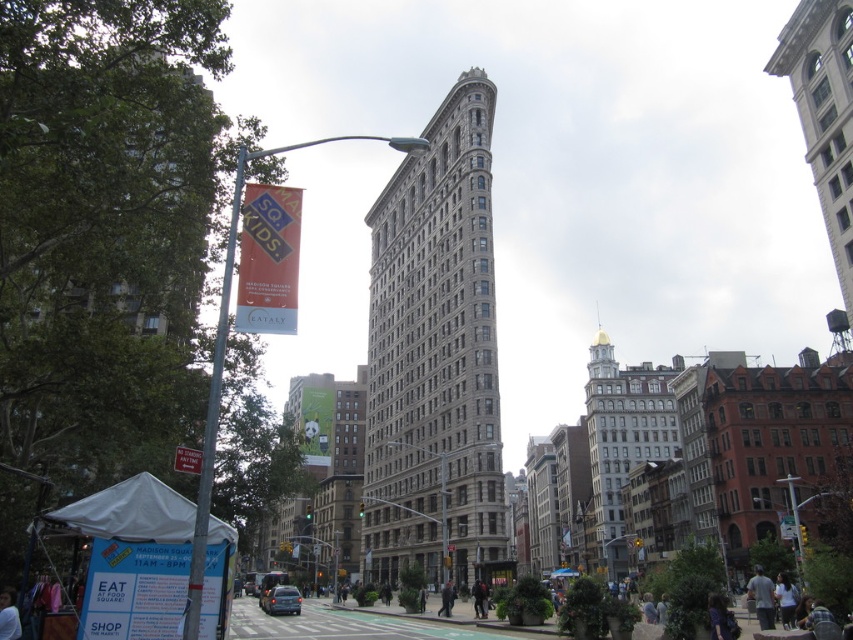
Question: Can you confirm if gray stone building at center is bigger than white stone bell tower at upper right?

Choices:
 (A) yes
 (B) no

Answer: (B)

Question: Is white stone bell tower at upper right above red plastic sign at lower left?

Choices:
 (A) yes
 (B) no

Answer: (A)

Question: Where is light gray shirt at lower right located in relation to white plastic street sign at center in the image?

Choices:
 (A) right
 (B) left

Answer: (B)

Question: Among these objects, which one is nearest to the camera?

Choices:
 (A) white plastic street sign at center
 (B) metallic pole at left

Answer: (B)

Question: Among these objects, which one is nearest to the camera?

Choices:
 (A) metallic pole at left
 (B) white cotton shirt at lower left
 (C) white stone bell tower at upper right

Answer: (A)

Question: Which point is closer to the camera?

Choices:
 (A) (834, 104)
 (B) (13, 602)
 (C) (177, 445)
 (D) (769, 586)

Answer: (B)